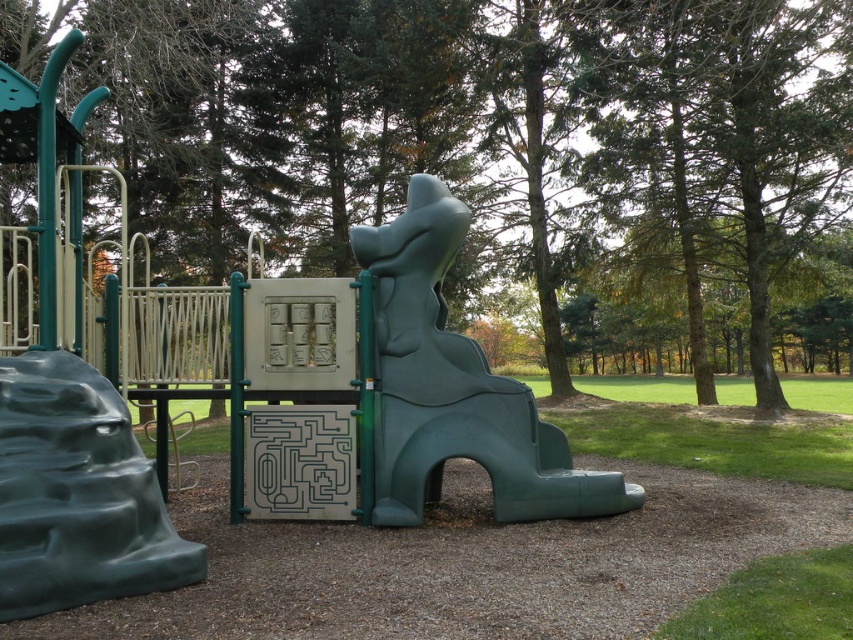
Question: Which point is farther to the camera?

Choices:
 (A) green rubber slide at lower left
 (B) teal matte slide at center

Answer: (B)

Question: Does teal matte slide at center appear over green rubber slide at lower left?

Choices:
 (A) yes
 (B) no

Answer: (A)

Question: Which object is farther from the camera taking this photo?

Choices:
 (A) teal matte slide at center
 (B) green rubber slide at lower left

Answer: (A)

Question: Where is teal matte slide at center located in relation to green rubber slide at lower left in the image?

Choices:
 (A) right
 (B) left

Answer: (A)

Question: Is teal matte slide at center bigger than green rubber slide at lower left?

Choices:
 (A) yes
 (B) no

Answer: (A)